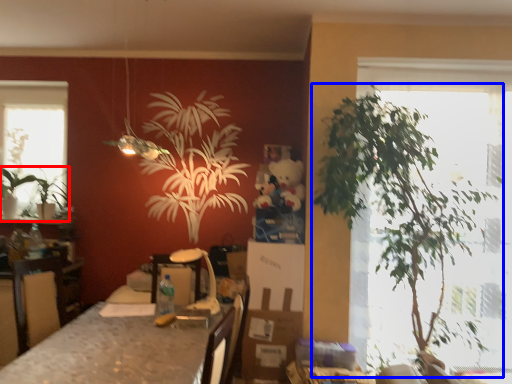
Question: Which point is further to the camera, houseplant (highlighted by a red box) or houseplant (highlighted by a blue box)?

Choices:
 (A) houseplant
 (B) houseplant

Answer: (A)